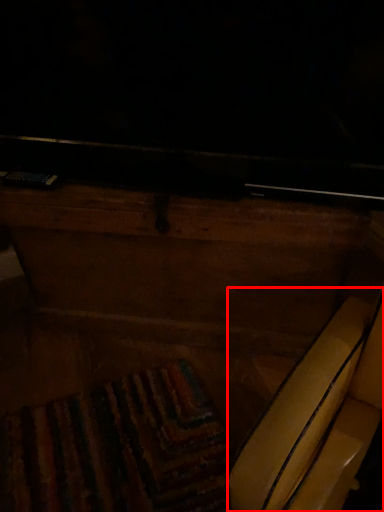
Question: From the image's perspective, what is the correct spatial positioning of swivel chair (annotated by the red box) in reference to furniture?

Choices:
 (A) below
 (B) above

Answer: (A)